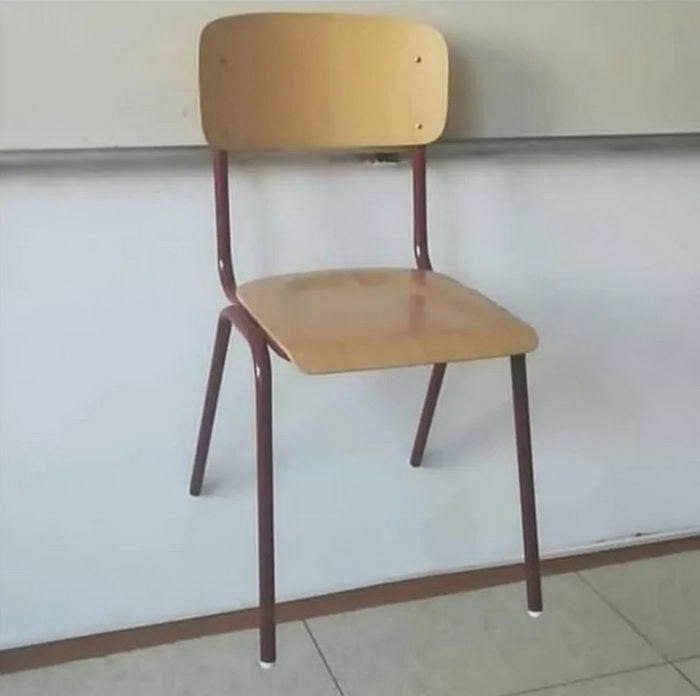
The image size is (700, 696). Find the location of `backrest of the chair`. backrest of the chair is located at coordinates (307, 70).